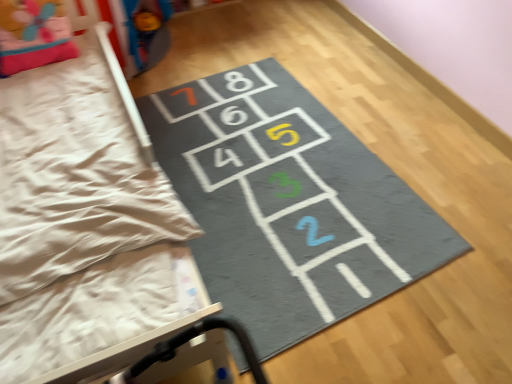
Question: Which is correct: pink fabric pillow at upper left is inside gray fabric hopscotch at center, or outside of it?

Choices:
 (A) inside
 (B) outside

Answer: (B)

Question: Does point (54, 6) appear closer or farther from the camera than point (278, 148)?

Choices:
 (A) farther
 (B) closer

Answer: (B)

Question: Is pink fabric pillow at upper left wider or thinner than gray fabric hopscotch at center?

Choices:
 (A) thin
 (B) wide

Answer: (A)

Question: Looking at the image, does gray fabric hopscotch at center seem bigger or smaller compared to pink fabric pillow at upper left?

Choices:
 (A) big
 (B) small

Answer: (A)

Question: Considering the positions of gray fabric hopscotch at center and pink fabric pillow at upper left in the image, is gray fabric hopscotch at center taller or shorter than pink fabric pillow at upper left?

Choices:
 (A) tall
 (B) short

Answer: (B)

Question: From a real-world perspective, is gray fabric hopscotch at center above or below pink fabric pillow at upper left?

Choices:
 (A) below
 (B) above

Answer: (A)

Question: In terms of width, does gray fabric hopscotch at center look wider or thinner when compared to pink fabric pillow at upper left?

Choices:
 (A) thin
 (B) wide

Answer: (B)